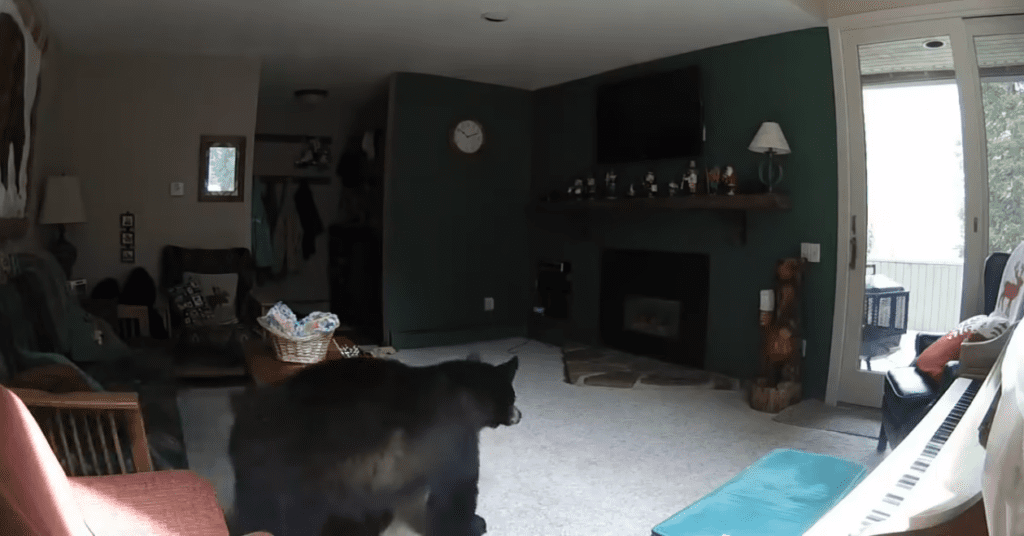
Identify the location of mantle. Image resolution: width=1024 pixels, height=536 pixels. (656, 196).